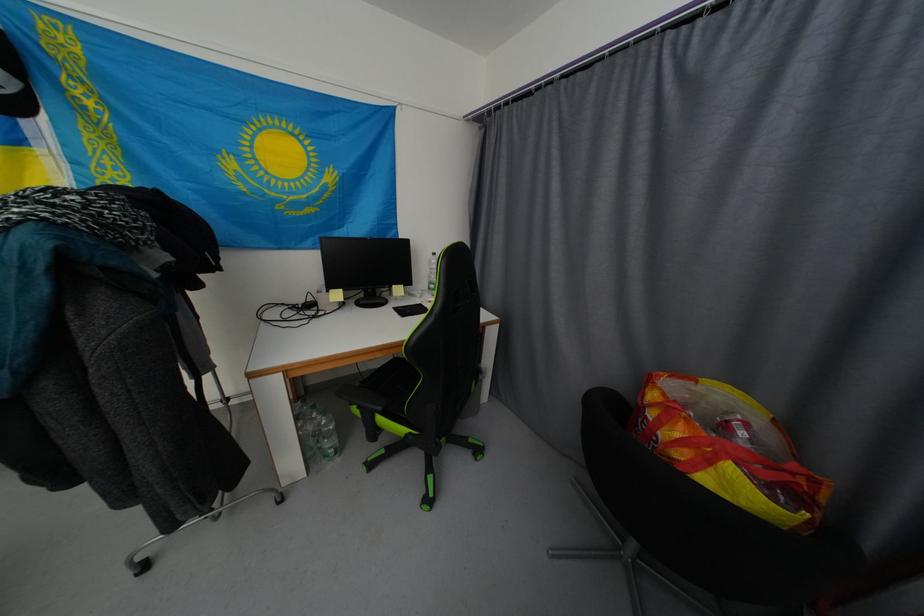
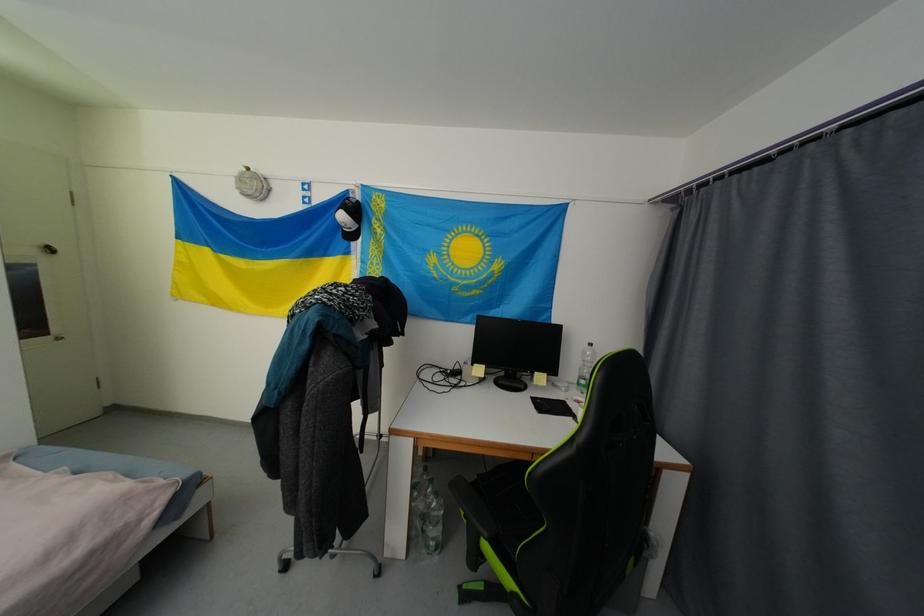
Question: The images are taken continuously from a first-person perspective. In which direction is your viewpoint rotating?

Choices:
 (A) Left
 (B) Right
 (C) Up
 (D) Down

Answer: (A)